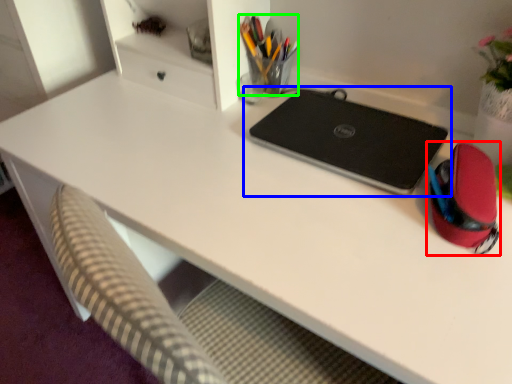
Question: Which object is the closest to the stationery (highlighted by a red box)? Choose among these: laptop (highlighted by a blue box) or stationery (highlighted by a green box).

Choices:
 (A) laptop
 (B) stationery

Answer: (A)